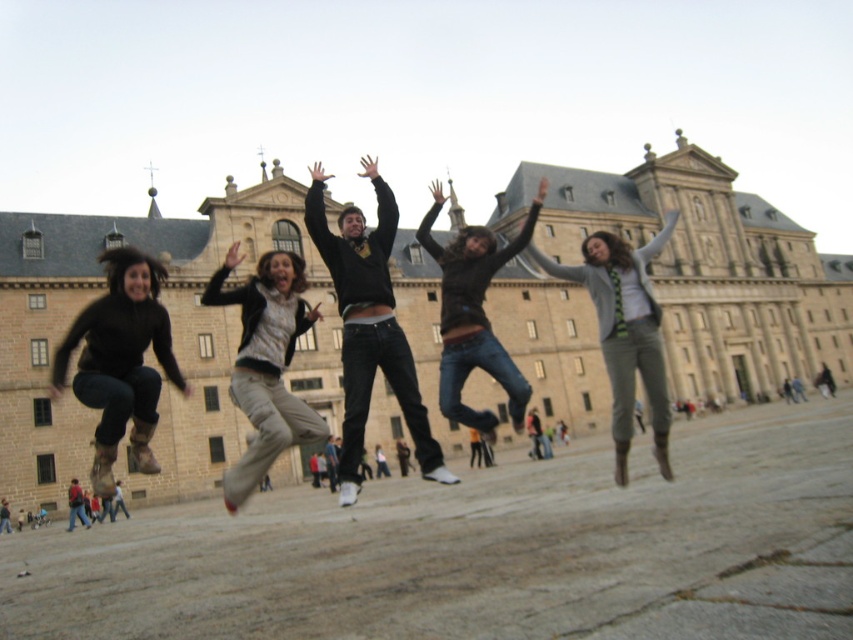
Looking at this image, you are a photographer trying to capture the two subjects in the scene. The matte black sweater at left and the khaki pants at center are both in your viewfinder. Based on their sizes in the image, which one would you estimate is closer to the camera?

The matte black sweater at left has a lesser width compared to the khaki pants at center. Since objects closer to the camera appear larger, the khaki pants at center must be farther away, making the matte black sweater at left closer to the camera.

You are standing in front of the historic building and see the jeans at center and the red jacket at lower left. Which clothing item is positioned closer to the right side of the scene?

The jeans at center is positioned to the right of the red jacket at lower left, so the jeans at center is closer to the right side of the scene.

You are a photographer standing in front of the historic building and want to capture a photo of the jeans at center and the red jacket at lower left. Which object is positioned higher in the image?

The jeans at center is located above the red jacket at lower left, so the jeans at center is positioned higher in the image.